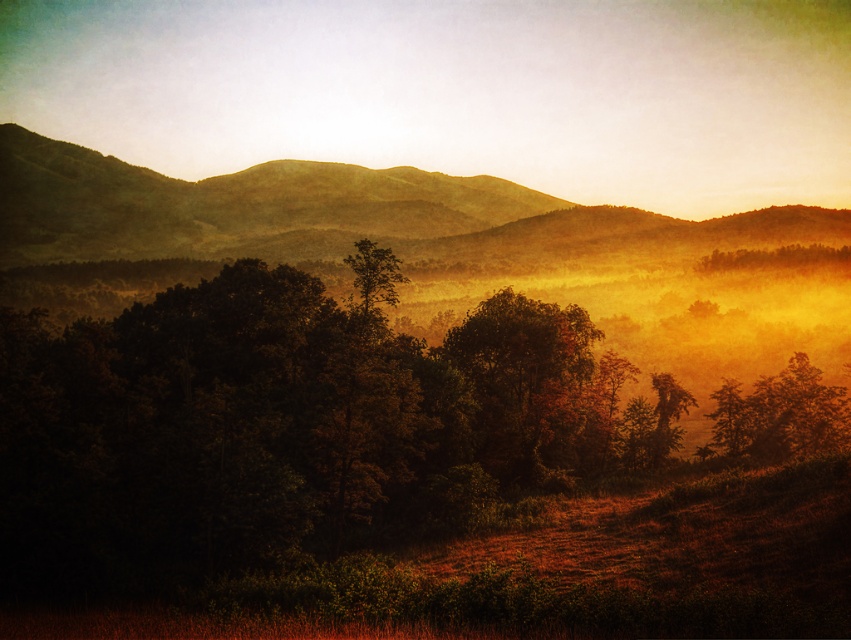
Question: Which of the following is the farthest from the observer?

Choices:
 (A) (545, 417)
 (B) (555, 396)

Answer: (B)

Question: Among these points, which one is farthest from the camera?

Choices:
 (A) (529, 346)
 (B) (435, 387)

Answer: (A)

Question: Is dark green foliage at center smaller than green matte tree at center?

Choices:
 (A) yes
 (B) no

Answer: (B)

Question: Does dark green foliage at center appear under green matte tree at center?

Choices:
 (A) no
 (B) yes

Answer: (A)

Question: Which point is farther from the camera taking this photo?

Choices:
 (A) (552, 444)
 (B) (358, 529)

Answer: (A)

Question: Is dark green foliage at center bigger than green matte tree at center?

Choices:
 (A) no
 (B) yes

Answer: (B)